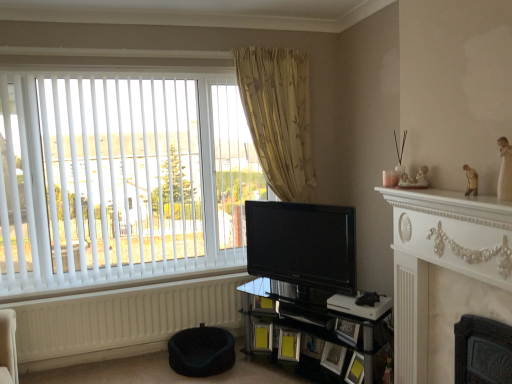
This screenshot has height=384, width=512. I want to click on free point above white vertical blinds at left (from a real-world perspective), so click(137, 65).